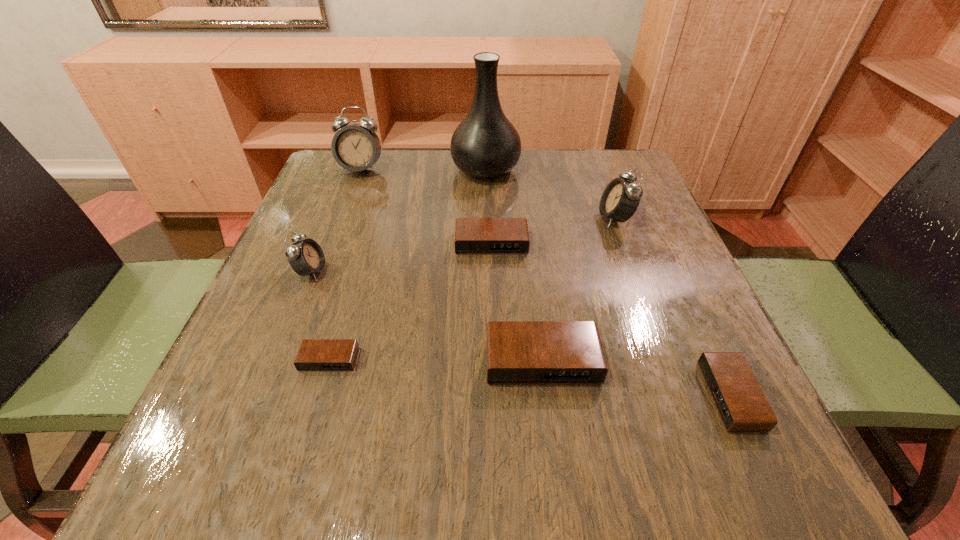
Where is `the tallest object`? Image resolution: width=960 pixels, height=540 pixels. the tallest object is located at coordinates (485, 145).

This screenshot has width=960, height=540. I want to click on the tallest alarm clock, so click(x=356, y=147).

The image size is (960, 540). What are the coordinates of `the biggest white alarm clock` in the screenshot? It's located at (356, 147).

Locate an element on the screen. The width and height of the screenshot is (960, 540). the sixth nearest object is located at coordinates (620, 199).

Identify the location of the rightmost white alarm clock. Image resolution: width=960 pixels, height=540 pixels. (620, 199).

The height and width of the screenshot is (540, 960). I want to click on the nearest white alarm clock, so click(x=305, y=257).

Locate an element on the screen. This screenshot has height=540, width=960. the fifth farthest object is located at coordinates (305, 257).

Identify the location of the fifth tallest object. The width and height of the screenshot is (960, 540). (518, 352).

You are a GUI agent. You are given a task and a screenshot of the screen. Output one action in this format:
    pyautogui.click(x=<x>, y=<y>)
    Task: Click on the biggest black alarm clock
    Image resolution: width=960 pixels, height=540 pixels.
    Given the screenshot: What is the action you would take?
    pyautogui.click(x=518, y=352)

In order to click on the third farthest alarm clock in this screenshot , I will do `click(473, 236)`.